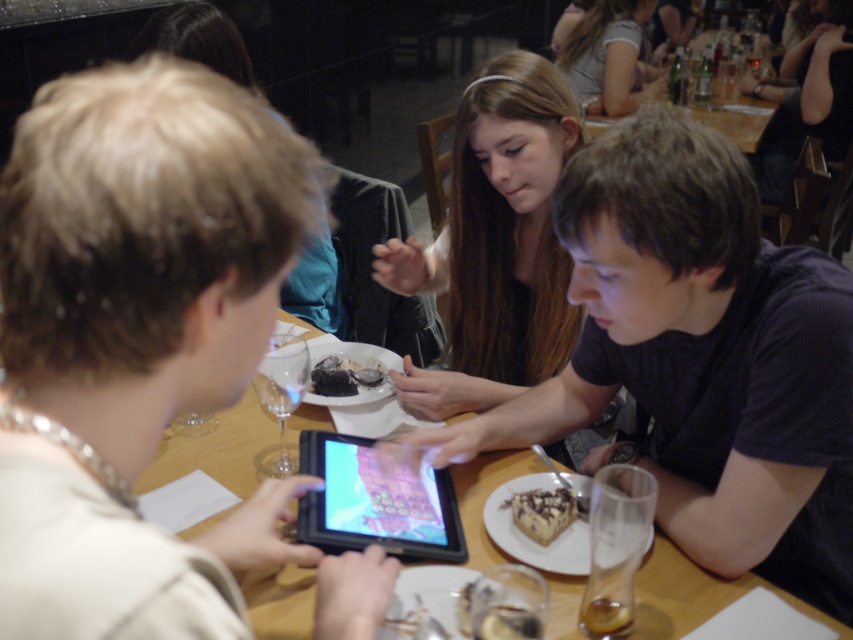
You are sitting at the wooden table in the image and want to reach both the point at coordinates point (341, 508) and the point at coordinates point (569, 493). Which point will require you to reach further away from your current position?

The point at coordinates point (569, 493) will require reaching further away because it is farther from the viewer compared to point (341, 508).

You are a waiter in a restaurant and need to place a new drink order on the table. The table has a black glossy tablet at center. Where should you place the drink to avoid covering the tablet?

Place the drink away from the black glossy tablet at center, specifically not at point [374,502] to avoid covering it.